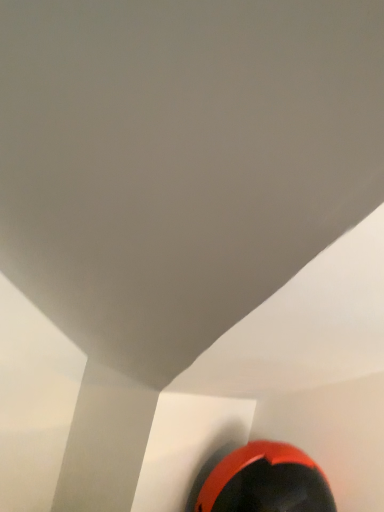
Find the location of a particular element. Image resolution: width=384 pixels, height=512 pixels. glossy black ball at lower right is located at coordinates (266, 482).

The height and width of the screenshot is (512, 384). Describe the element at coordinates (266, 482) in the screenshot. I see `glossy black ball at lower right` at that location.

This screenshot has width=384, height=512. In order to click on glossy black ball at lower right in this screenshot , I will do `click(266, 482)`.